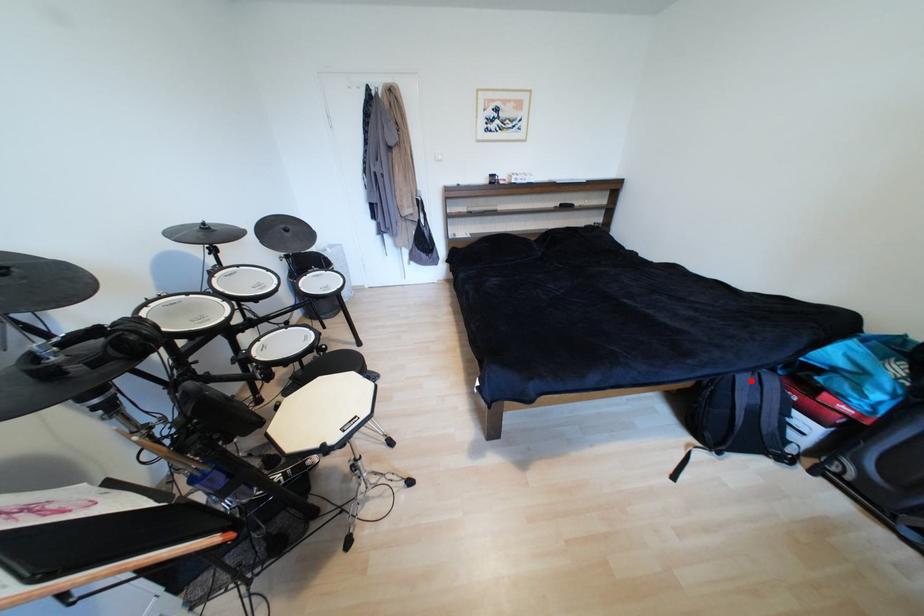
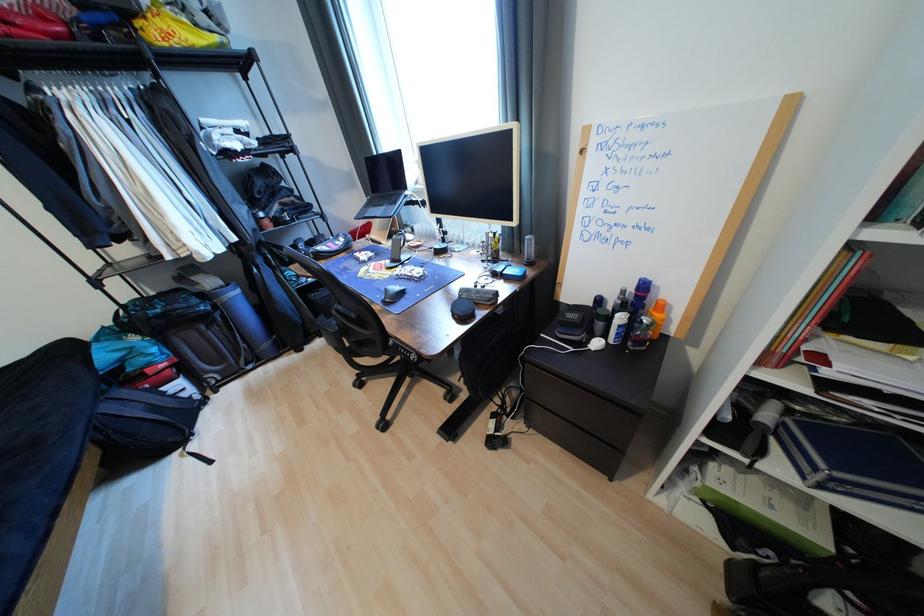
Where in the second image is the point corresponding to the highlighted location from the first image?

(116, 408)